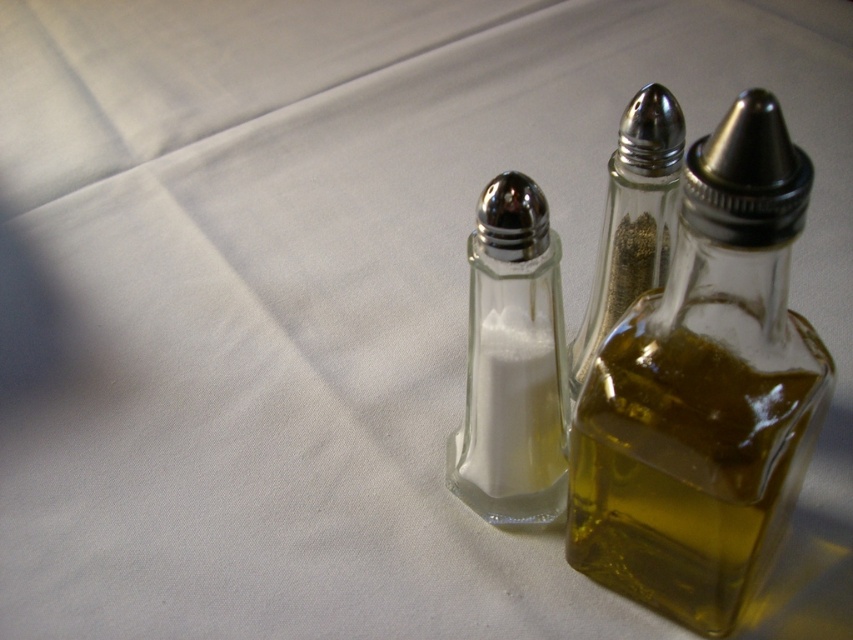
You are a chef preparing a dish and need to locate the transparent glass bottle at center. According to the scene description, where would you find it?

The transparent glass bottle at center is located at point (705, 390).

You are standing 1 meter away from the table. Can you reach the point at coordinates point (704, 417) without moving your hand more than 60 centimeters?

The point at coordinates point (704, 417) is 45.08 centimeters from the viewer. Since you are standing 1 meter away, the total distance to reach it would be 1 meter plus 45.08 centimeters, which is 145.08 centimeters. Moving your hand 60 centimeters is insufficient to reach it.

You are setting up a dining table and need to place the transparent glass bottle at center and the clear glass pepper grinder at center. Which one should you place first if you want the bigger item to be on the right side?

The transparent glass bottle at center is bigger than the clear glass pepper grinder at center, so you should place the transparent glass bottle at center first on the right side to ensure the bigger item is positioned there.